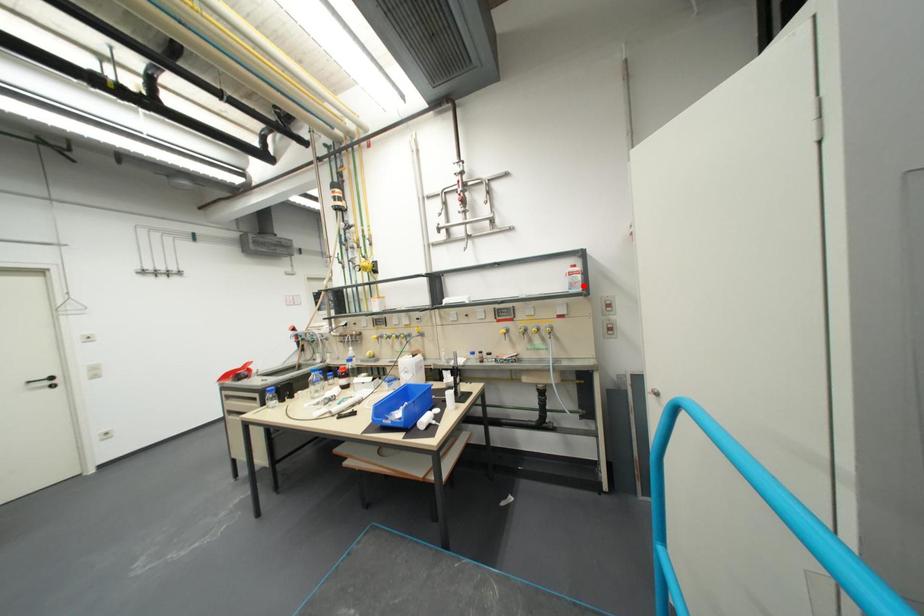
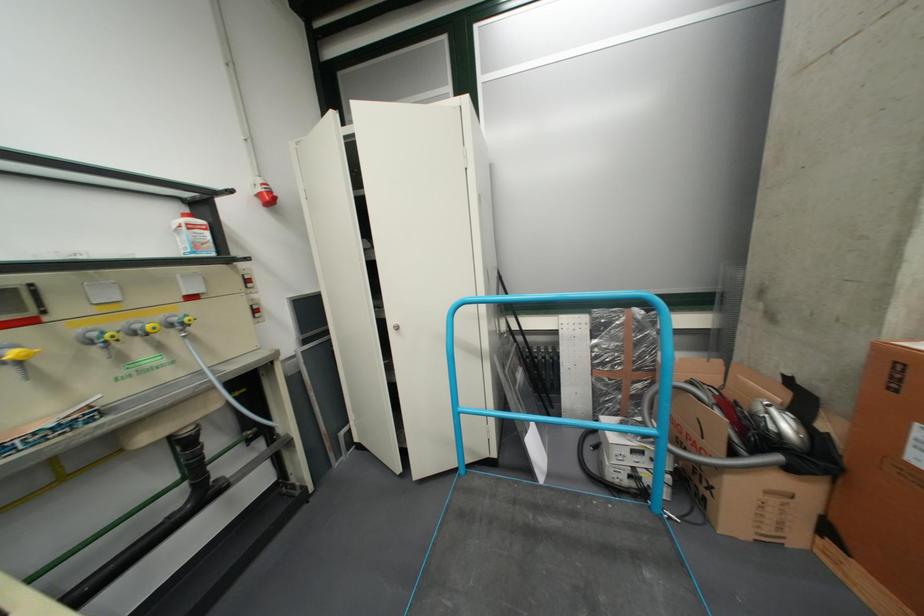
Where in the second image is the point corresponding to the highlighted location from the first image?

(208, 246)